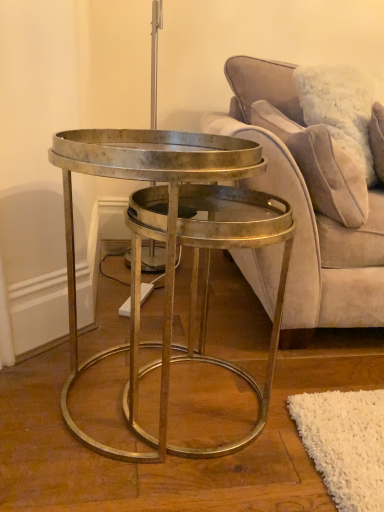
Question: Is velvet beige couch at center aimed at metallic gold coffee table at center?

Choices:
 (A) no
 (B) yes

Answer: (A)

Question: Is velvet beige couch at center positioned behind metallic gold coffee table at center?

Choices:
 (A) yes
 (B) no

Answer: (A)

Question: Would you say velvet beige couch at center is outside metallic gold coffee table at center?

Choices:
 (A) yes
 (B) no

Answer: (A)

Question: Would you say metallic gold coffee table at center is part of velvet beige couch at center's contents?

Choices:
 (A) no
 (B) yes

Answer: (A)

Question: Is velvet beige couch at center at the right side of metallic gold coffee table at center?

Choices:
 (A) no
 (B) yes

Answer: (B)

Question: Considering their positions, is velvet beige pillow at upper right located in front of or behind metallic gold coffee table at center?

Choices:
 (A) front
 (B) behind

Answer: (B)

Question: Is velvet beige pillow at upper right taller or shorter than metallic gold coffee table at center?

Choices:
 (A) short
 (B) tall

Answer: (A)

Question: Does point (253, 117) appear closer or farther from the camera than point (188, 208)?

Choices:
 (A) closer
 (B) farther

Answer: (B)

Question: Looking at their shapes, would you say velvet beige pillow at upper right is wider or thinner than metallic gold coffee table at center?

Choices:
 (A) thin
 (B) wide

Answer: (A)

Question: In terms of height, does metallic gold coffee table at center look taller or shorter compared to velvet beige couch at center?

Choices:
 (A) tall
 (B) short

Answer: (B)

Question: Is metallic gold coffee table at center situated inside velvet beige couch at center or outside?

Choices:
 (A) outside
 (B) inside

Answer: (A)

Question: From the image's perspective, is metallic gold coffee table at center positioned above or below velvet beige couch at center?

Choices:
 (A) above
 (B) below

Answer: (B)

Question: From a real-world perspective, is metallic gold coffee table at center physically located above or below velvet beige couch at center?

Choices:
 (A) above
 (B) below

Answer: (B)

Question: Is velvet beige pillow at upper right inside the boundaries of velvet beige couch at center, or outside?

Choices:
 (A) outside
 (B) inside

Answer: (B)

Question: Is velvet beige pillow at upper right bigger or smaller than velvet beige couch at center?

Choices:
 (A) small
 (B) big

Answer: (A)